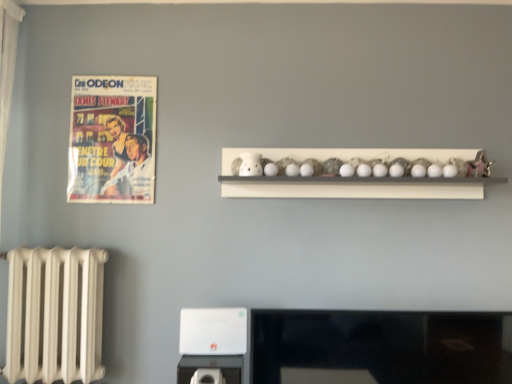
Question: Based on their sizes in the image, would you say white plastic appliance at lower center is bigger or smaller than white matte shelf at upper center?

Choices:
 (A) small
 (B) big

Answer: (A)

Question: From the image's perspective, relative to white matte shelf at upper center, is white plastic appliance at lower center above or below?

Choices:
 (A) below
 (B) above

Answer: (A)

Question: Which of these objects is positioned farthest from the white matte shelf at upper center?

Choices:
 (A) white plastic appliance at lower center
 (B) matte paper poster at upper left

Answer: (A)

Question: Which of these objects is positioned closest to the white plastic appliance at lower center?

Choices:
 (A) matte paper poster at upper left
 (B) white matte shelf at upper center

Answer: (B)